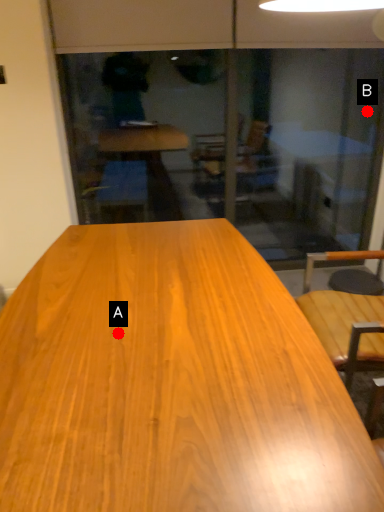
Question: Two points are circled on the image, labeled by A and B beside each circle. Which point is closer to the camera?

Choices:
 (A) A is closer
 (B) B is closer

Answer: (A)